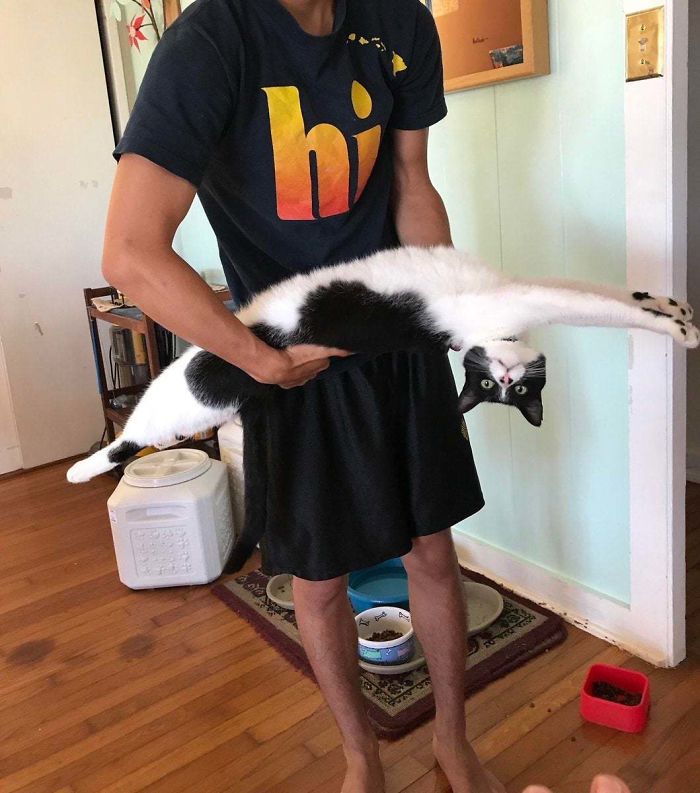
The width and height of the screenshot is (700, 793). I want to click on switch, so click(648, 37).